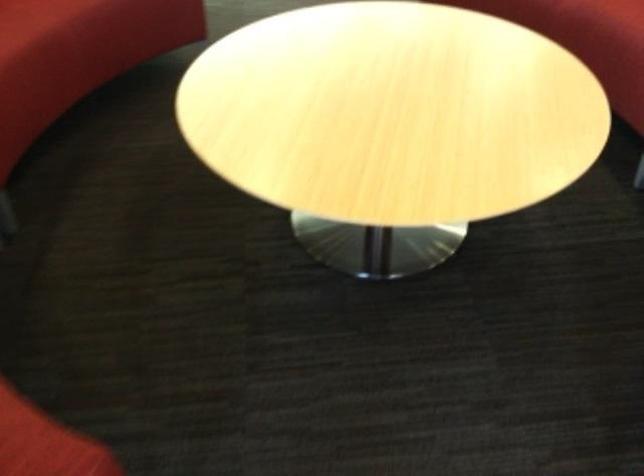
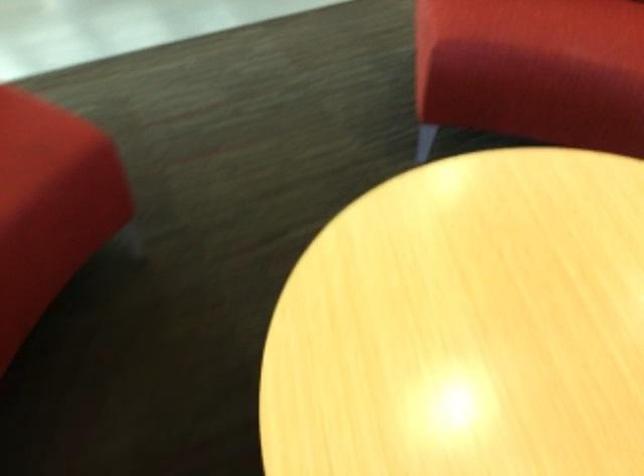
Question: What movement of the cameraman would produce the second image?

Choices:
 (A) Left
 (B) Right
 (C) Forward
 (D) Backward

Answer: (D)